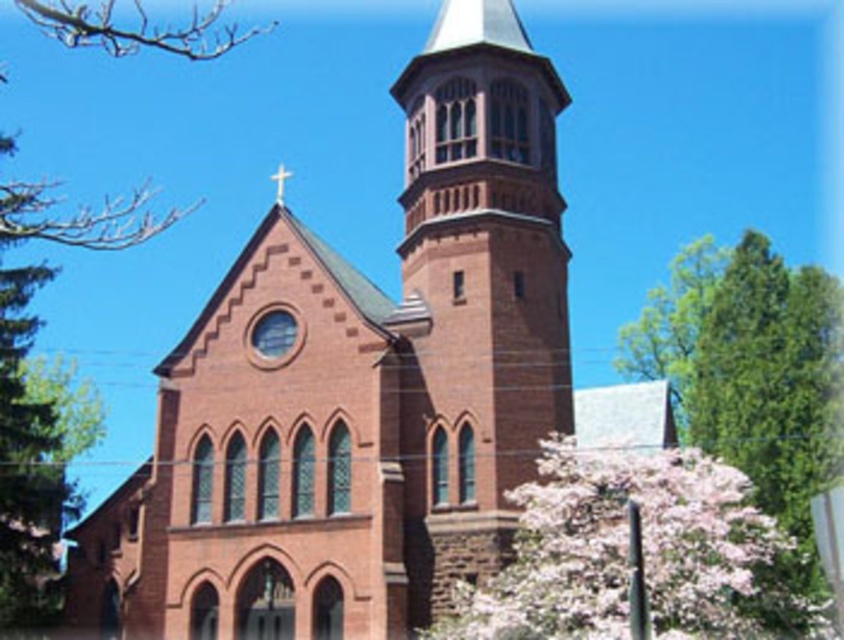
Question: Is green leafy tree at upper left positioned in front of smooth wooden cross at upper center?

Choices:
 (A) no
 (B) yes

Answer: (B)

Question: Which of the following is the farthest from the observer?

Choices:
 (A) green leafy tree at upper left
 (B) smooth wooden cross at upper center
 (C) red brick church at center

Answer: (B)

Question: Does red brick church at center have a greater width compared to smooth wooden cross at upper center?

Choices:
 (A) yes
 (B) no

Answer: (A)

Question: Which point appears closest to the camera in this image?

Choices:
 (A) tap(766, 531)
 (B) tap(33, 438)
 (C) tap(664, 339)

Answer: (A)

Question: Which is farther from the pink blossoms at lower right?

Choices:
 (A) smooth wooden cross at upper center
 (B) green leafy tree at upper right

Answer: (A)

Question: Can you confirm if red brick church at center is positioned below pink blossoms at lower right?

Choices:
 (A) no
 (B) yes

Answer: (A)